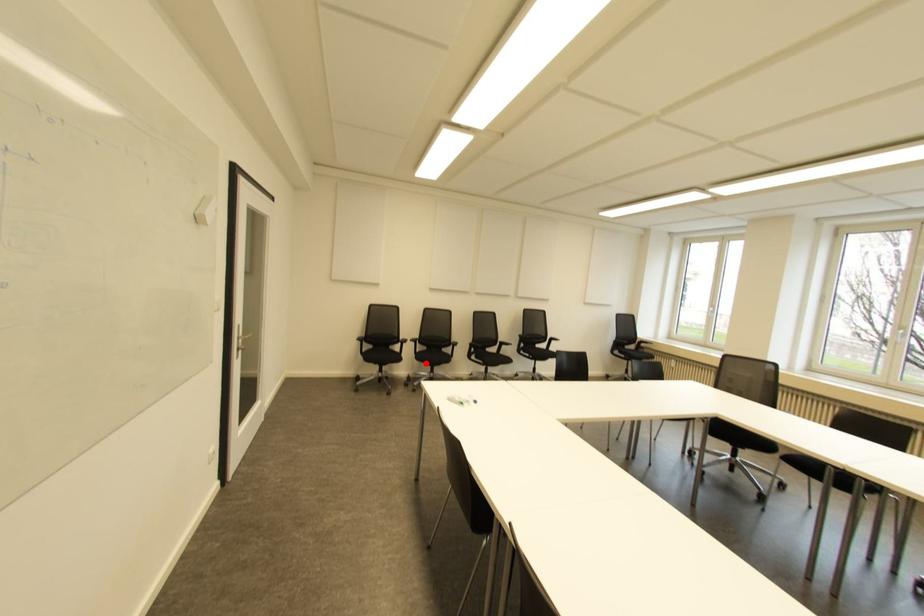
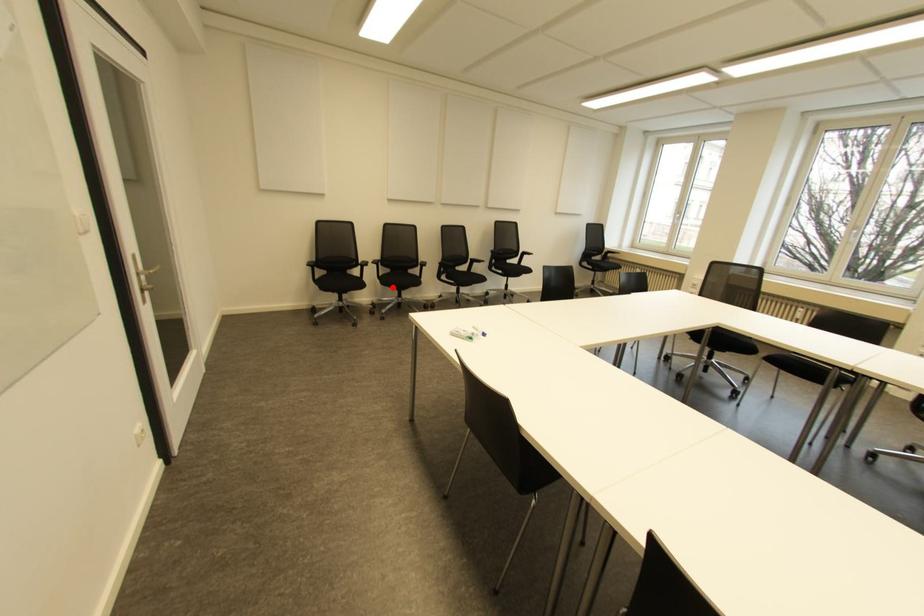
I am providing you with two images of the same scene from different viewpoints. A red point is marked on the first image and another point is marked on the second image. Do the highlighted points in image1 and image2 indicate the same real-world spot?

Yes